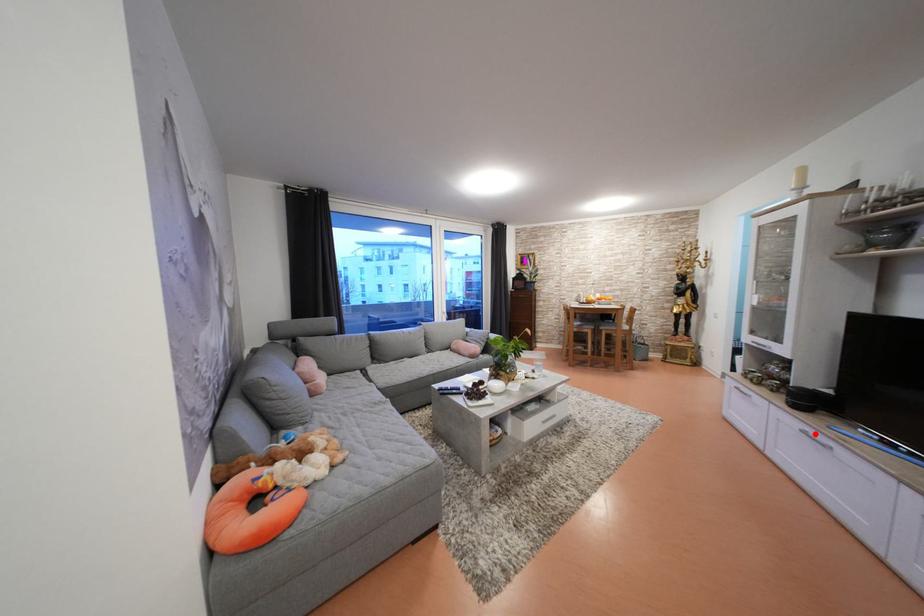
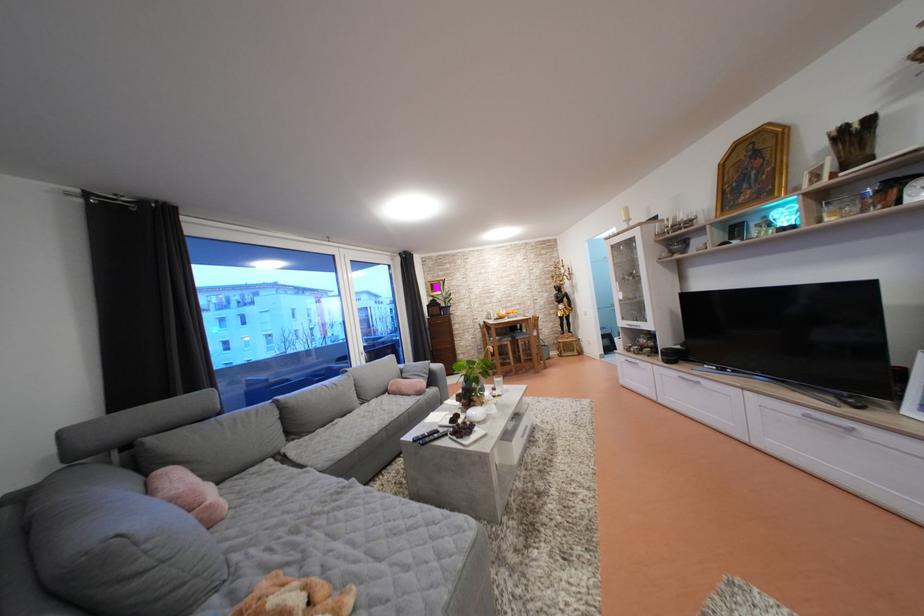
Question: I am providing you with two images of the same scene from different viewpoints. Image1 has a red point marked. In image2, the corresponding 3D location appears at what relative position? Reply with the corresponding letter.

Choices:
 (A) Closer
 (B) Farther

Answer: (A)